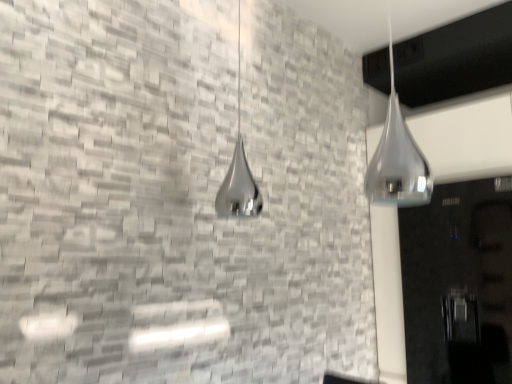
Question: Considering the relative sizes of polished chrome shower at upper right, the 2th shower positioned from the left, and polished chrome shower at center, marked as the 2th shower in a right-to-left arrangement, in the image provided, is polished chrome shower at upper right, the 2th shower positioned from the left, wider than polished chrome shower at center, marked as the 2th shower in a right-to-left arrangement,?

Choices:
 (A) yes
 (B) no

Answer: (B)

Question: Considering the relative positions of polished chrome shower at upper right, placed as the second shower when sorted from back to front, and polished chrome shower at center, marked as the 2th shower in a right-to-left arrangement, in the image provided, is polished chrome shower at upper right, placed as the second shower when sorted from back to front, to the left of polished chrome shower at center, marked as the 2th shower in a right-to-left arrangement, from the viewer's perspective?

Choices:
 (A) no
 (B) yes

Answer: (A)

Question: Is polished chrome shower at upper right, placed as the second shower when sorted from back to front, completely or partially outside of polished chrome shower at center, marked as the 2th shower in a right-to-left arrangement?

Choices:
 (A) yes
 (B) no

Answer: (A)

Question: From the image's perspective, is polished chrome shower at upper right, the 2th shower positioned from the left, located above polished chrome shower at center, acting as the 2th shower starting from the front?

Choices:
 (A) no
 (B) yes

Answer: (A)

Question: Considering the relative sizes of polished chrome shower at upper right, which ranks as the first shower in right-to-left order, and polished chrome shower at center, acting as the 2th shower starting from the front, in the image provided, is polished chrome shower at upper right, which ranks as the first shower in right-to-left order, smaller than polished chrome shower at center, acting as the 2th shower starting from the front,?

Choices:
 (A) yes
 (B) no

Answer: (A)

Question: Is polished chrome shower at upper right, which ranks as the first shower in right-to-left order, inside or outside of glossy black door at right?

Choices:
 (A) outside
 (B) inside

Answer: (A)

Question: From a real-world perspective, is polished chrome shower at upper right, the 2th shower positioned from the left, positioned above or below glossy black door at right?

Choices:
 (A) below
 (B) above

Answer: (B)

Question: Considering the positions of polished chrome shower at upper right, placed as the second shower when sorted from back to front, and glossy black door at right in the image, is polished chrome shower at upper right, placed as the second shower when sorted from back to front, wider or thinner than glossy black door at right?

Choices:
 (A) thin
 (B) wide

Answer: (A)

Question: In the image, is polished chrome shower at upper right, placed as the second shower when sorted from back to front, positioned in front of or behind glossy black door at right?

Choices:
 (A) front
 (B) behind

Answer: (A)

Question: Would you say glossy black door at right is inside or outside polished chrome shower at upper right, which is the first shower in front-to-back order?

Choices:
 (A) inside
 (B) outside

Answer: (B)

Question: Would you say glossy black door at right is to the left or to the right of polished chrome shower at upper right, which is the first shower in front-to-back order, in the picture?

Choices:
 (A) left
 (B) right

Answer: (B)

Question: Looking at their shapes, would you say glossy black door at right is wider or thinner than polished chrome shower at upper right, the 2th shower positioned from the left?

Choices:
 (A) thin
 (B) wide

Answer: (B)

Question: From a real-world perspective, relative to polished chrome shower at upper right, which ranks as the first shower in right-to-left order, is glossy black door at right vertically above or below?

Choices:
 (A) below
 (B) above

Answer: (A)

Question: From a real-world perspective, is polished chrome shower at upper right, which is the first shower in front-to-back order, physically located above or below polished chrome shower at center, which is counted as the 1th shower, starting from the back?

Choices:
 (A) below
 (B) above

Answer: (A)

Question: Based on their positions, is polished chrome shower at upper right, which ranks as the first shower in right-to-left order, located to the left or right of polished chrome shower at center, placed as the 1th shower when sorted from left to right?

Choices:
 (A) right
 (B) left

Answer: (A)